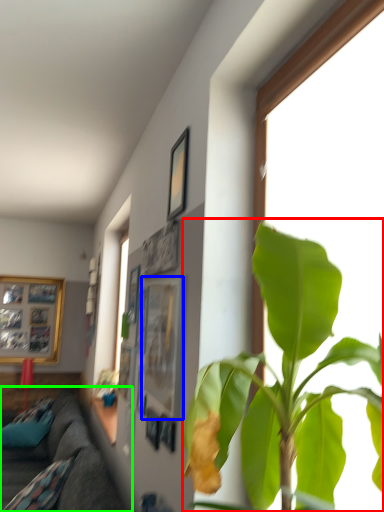
Question: Which is nearer to the houseplant (highlighted by a red box)? picture frame (highlighted by a blue box) or studio couch (highlighted by a green box).

Choices:
 (A) picture frame
 (B) studio couch

Answer: (A)